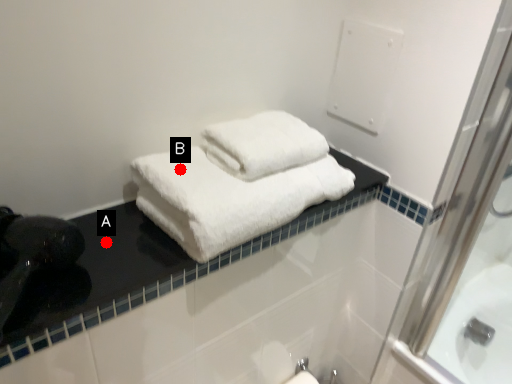
Question: Two points are circled on the image, labeled by A and B beside each circle. Which point is further to the camera?

Choices:
 (A) A is further
 (B) B is further

Answer: (B)